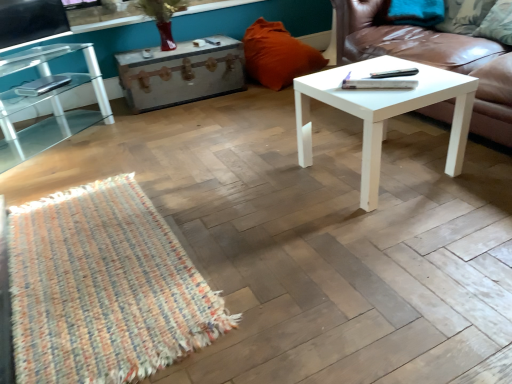
Where is `free space in front of rustic wood trunk at center`? Image resolution: width=512 pixels, height=384 pixels. free space in front of rustic wood trunk at center is located at coordinates (188, 121).